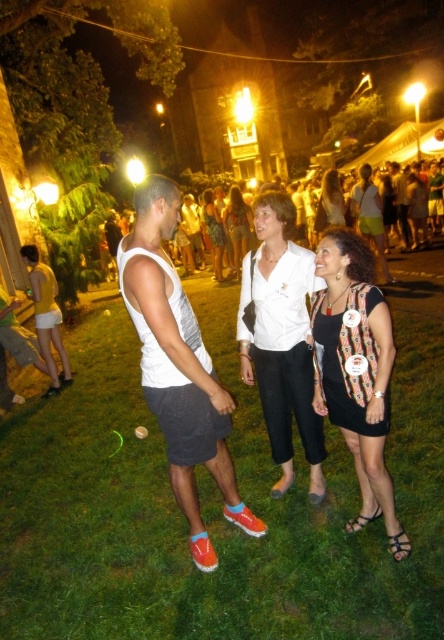
Between point (268, 193) and point (322, 214), which one is positioned in front?

Point (268, 193)

Does white smooth shirt at center lie in front of matte black dress at center?

Yes, white smooth shirt at center is closer to the viewer.

Which is behind, point (273, 374) or point (325, 218)?

Point (325, 218)

What are the coordinates of `white smooth shirt at center` in the screenshot? It's located at (281, 337).

Who is taller, green grass at center or matte yellow tank top at left?

Standing taller between the two is matte yellow tank top at left.

Based on the photo, how much distance is there between green grass at center and matte yellow tank top at left?

The distance of green grass at center from matte yellow tank top at left is 5.37 meters.

Is point (348, 536) less distant than point (48, 365)?

Yes, it is in front of point (48, 365).

This screenshot has width=444, height=640. I want to click on green grass at center, so click(214, 506).

Is matte black dress at center taller than white shirt at center?

No, matte black dress at center is not taller than white shirt at center.

Who is shorter, matte black dress at center or white shirt at center?

Standing shorter between the two is matte black dress at center.

Does point (322, 196) come behind point (225, 248)?

No, it is not.

Locate an element on the screen. This screenshot has width=444, height=640. matte black dress at center is located at coordinates (330, 202).